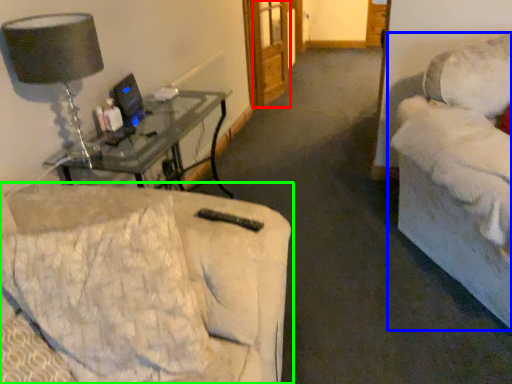
Question: Which object is the closest to the glass door (highlighted by a red box)? Choose among these: studio couch (highlighted by a blue box) or studio couch (highlighted by a green box).

Choices:
 (A) studio couch
 (B) studio couch

Answer: (A)